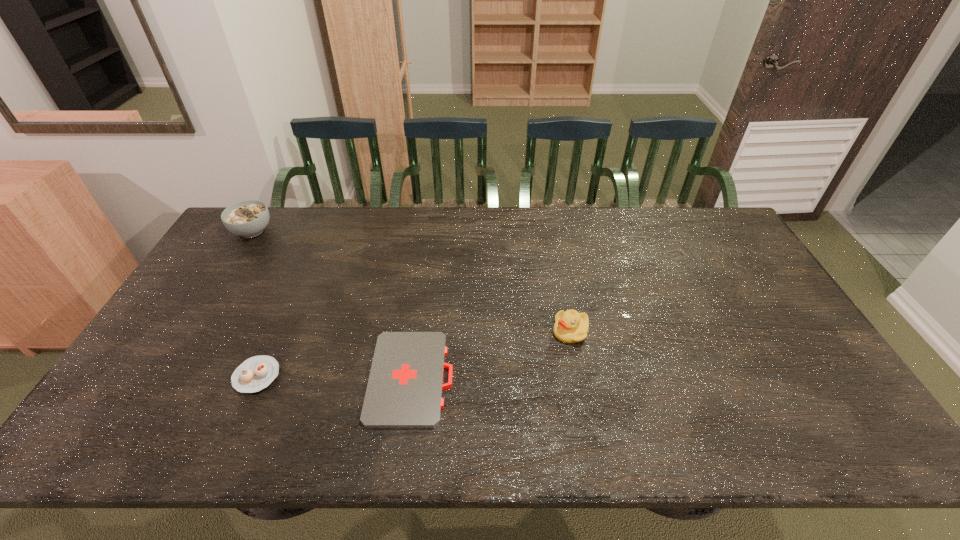
Image resolution: width=960 pixels, height=540 pixels. Find the location of `the farthest object`. the farthest object is located at coordinates (248, 218).

Find the location of a particular element. This screenshot has width=960, height=540. the leftmost object is located at coordinates (248, 218).

Find the location of a particular element. The width and height of the screenshot is (960, 540). the rightmost object is located at coordinates (570, 326).

The image size is (960, 540). I want to click on the third tallest object, so click(256, 373).

Locate an element on the screen. cupcake is located at coordinates (256, 373).

Locate an element on the screen. This screenshot has width=960, height=540. the first-aid kit is located at coordinates (404, 391).

You are a GUI agent. You are given a task and a screenshot of the screen. Output one action in this format:
    pyautogui.click(x=<x>, y=<y>)
    Task: Click on the shortest object
    
    Given the screenshot: What is the action you would take?
    pyautogui.click(x=404, y=391)

This screenshot has width=960, height=540. What are the coordinates of `free space located on the front of the soup bowl` in the screenshot? It's located at (238, 254).

Where is `blank space located 0.360m on the beak of the duckling`? blank space located 0.360m on the beak of the duckling is located at coordinates (423, 332).

The image size is (960, 540). Find the location of `vacant region located on the beak of the duckling`. vacant region located on the beak of the duckling is located at coordinates (427, 332).